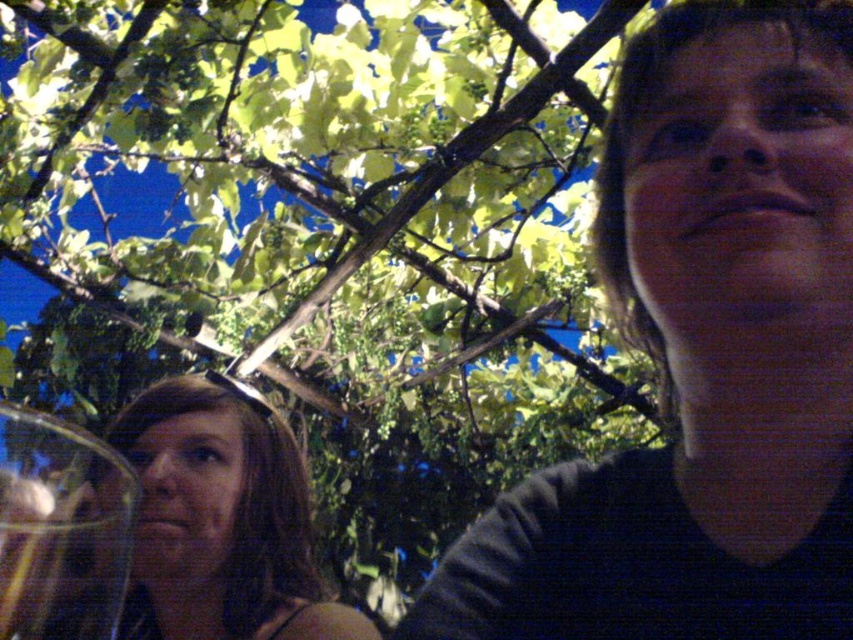
Where is the dark gray sweater at upper right located in the image?

The dark gray sweater at upper right is located at point (701, 358).

You are a photographer trying to capture the transparent glass at left without the dark gray sweater at upper right blocking it. Can you adjust your position to do so?

The dark gray sweater at upper right is positioned over the transparent glass at left, so moving your camera position downward or to the side might allow you to capture the transparent glass at left without obstruction from the dark gray sweater at upper right.